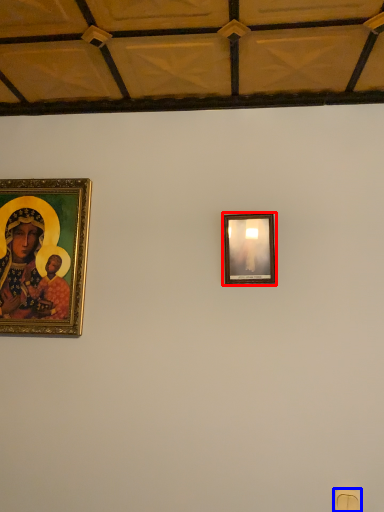
Question: Which object appears closest to the camera in this image, picture frame (highlighted by a red box) or light switch (highlighted by a blue box)?

Choices:
 (A) picture frame
 (B) light switch

Answer: (B)